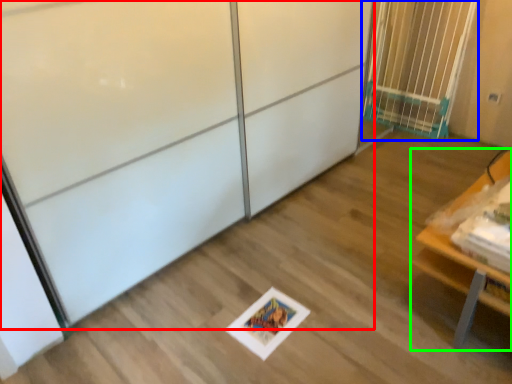
Question: Considering the real-world distances, which object is closest to screen door (highlighted by a red box)? elevator (highlighted by a blue box) or furniture (highlighted by a green box).

Choices:
 (A) elevator
 (B) furniture

Answer: (B)